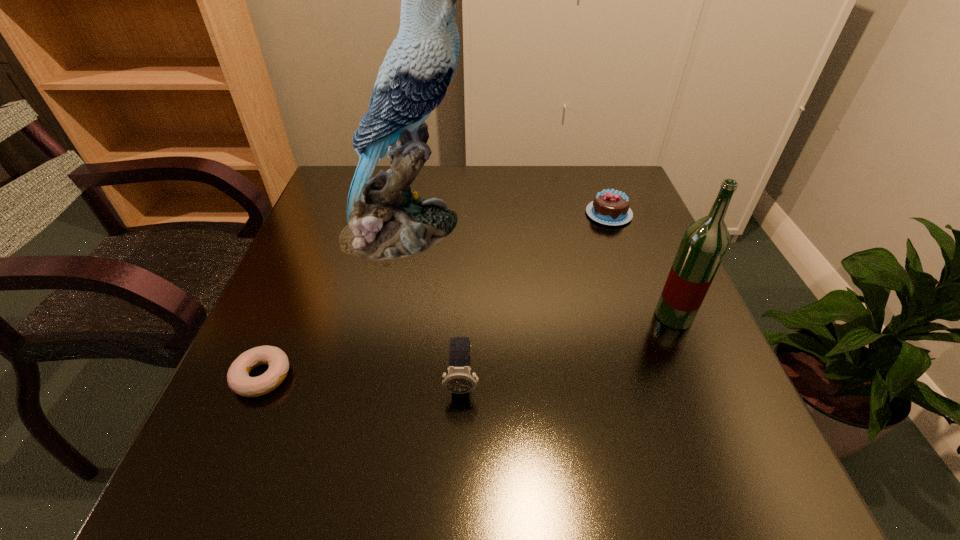
I want to click on the tallest object, so click(386, 220).

Where is `the second tallest object`? the second tallest object is located at coordinates pos(704,244).

You are a GUI agent. You are given a task and a screenshot of the screen. Output one action in this format:
    pyautogui.click(x=<x>, y=<y>)
    Task: Click on the third nearest object
    This screenshot has height=540, width=960.
    Given the screenshot: What is the action you would take?
    pyautogui.click(x=704, y=244)

Where is `the third shortest object`? The height and width of the screenshot is (540, 960). the third shortest object is located at coordinates click(x=459, y=379).

Where is `the second shortest object`? This screenshot has width=960, height=540. the second shortest object is located at coordinates 610,207.

Image resolution: width=960 pixels, height=540 pixels. Identify the location of doughnut. (238, 378).

You are a GUI agent. You are given a task and a screenshot of the screen. Output one action in this format:
    pyautogui.click(x=<x>, y=<y>)
    Task: Click on the blank area located 0.240m on the face of the parakeet
    The height and width of the screenshot is (540, 960).
    Given the screenshot: What is the action you would take?
    pyautogui.click(x=564, y=230)

Locate an element on the screen. free location located 0.070m on the left of the third nearest object is located at coordinates (620, 316).

In order to click on vacant space located on the face of the third shortest object in this screenshot , I will do `click(458, 498)`.

This screenshot has width=960, height=540. I want to click on vacant space located on the back of the fourth tallest object, so click(594, 174).